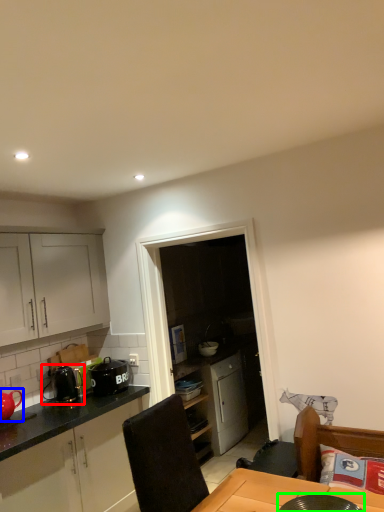
Question: Based on their relative distances, which object is farther from appliance (highlighted by a red box)? Choose from tea pot (highlighted by a blue box) and appliance (highlighted by a green box).

Choices:
 (A) tea pot
 (B) appliance

Answer: (B)